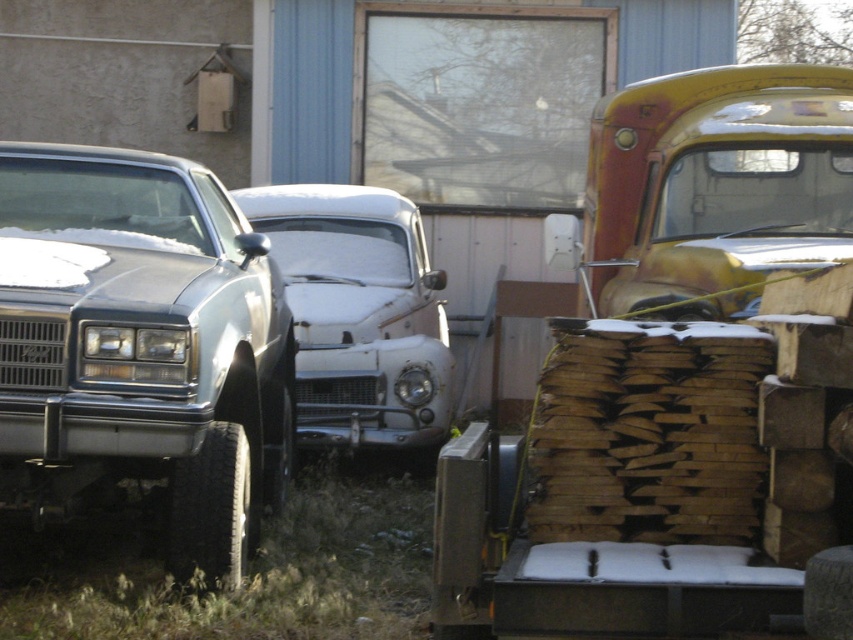
Question: Which point is farther to the camera?

Choices:
 (A) (189, 253)
 (B) (683, 93)
 (C) (302, 316)

Answer: (C)

Question: Which object appears farthest from the camera in this image?

Choices:
 (A) rusty metal truck at upper right
 (B) rusty metallic car at center

Answer: (B)

Question: Does satin silver car at left appear on the left side of rusty metallic car at center?

Choices:
 (A) no
 (B) yes

Answer: (B)

Question: Does rusty metal truck at upper right appear under rusty metallic car at center?

Choices:
 (A) no
 (B) yes

Answer: (A)

Question: Which object is the farthest from the satin silver car at left?

Choices:
 (A) rusty metallic car at center
 (B) rusty metal truck at upper right

Answer: (A)

Question: Can you confirm if satin silver car at left is wider than rusty metal truck at upper right?

Choices:
 (A) no
 (B) yes

Answer: (A)